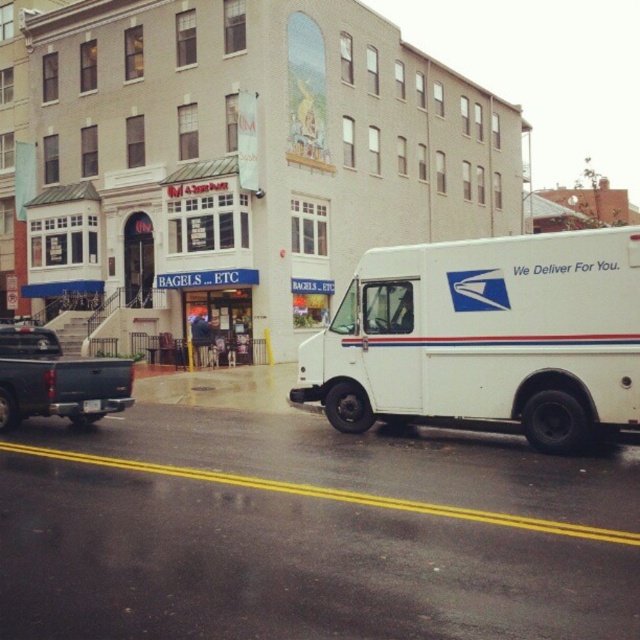
Who is lower down, white matte postal van at right or white plastic license plate at center?

white plastic license plate at center

What do you see at coordinates (486, 339) in the screenshot? I see `white matte postal van at right` at bounding box center [486, 339].

Locate an element on the screen. white matte postal van at right is located at coordinates (486, 339).

Can you confirm if matte black truck at left is taller than white plastic license plate at center?

Indeed, matte black truck at left has a greater height compared to white plastic license plate at center.

Which is more to the right, matte black truck at left or white plastic license plate at center?

From the viewer's perspective, white plastic license plate at center appears more on the right side.

This screenshot has height=640, width=640. Identify the location of matte black truck at left. (54, 380).

Between white matte postal van at right and matte black truck at left, which one appears on the left side from the viewer's perspective?

matte black truck at left

Does white matte postal van at right appear under matte black truck at left?

No.

Image resolution: width=640 pixels, height=640 pixels. Find the location of `white matte postal van at right`. white matte postal van at right is located at coordinates (486, 339).

I want to click on white matte postal van at right, so click(486, 339).